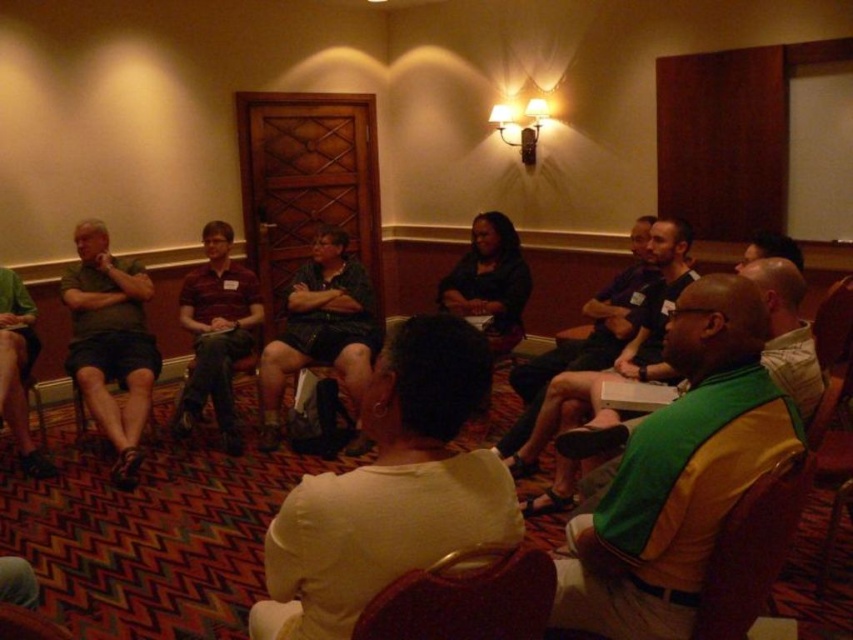
Based on the photo, is green/yellow jersey at center to the left of dark blue sweater at center from the viewer's perspective?

Incorrect, green/yellow jersey at center is not on the left side of dark blue sweater at center.

Which of these two, green/yellow jersey at center or dark blue sweater at center, stands shorter?

Standing shorter between the two is green/yellow jersey at center.

Which is in front, point (660, 636) or point (438, 284)?

Point (660, 636)

Identify the location of green/yellow jersey at center. (679, 472).

Can you confirm if dark green jersey at center is wider than green fabric shirt at center?

Correct, the width of dark green jersey at center exceeds that of green fabric shirt at center.

Who is more distant from viewer, [596,401] or [805,394]?

The point [596,401] is more distant.

Find the location of a particular element. The image size is (853, 640). dark green jersey at center is located at coordinates (619, 349).

Is green fabric shirt at center above black fabric chair at lower left?

Yes, green fabric shirt at center is above black fabric chair at lower left.

Between point (769, 259) and point (137, 400), which one is positioned in front?

Point (769, 259)

The width and height of the screenshot is (853, 640). I want to click on green fabric shirt at center, so click(x=786, y=332).